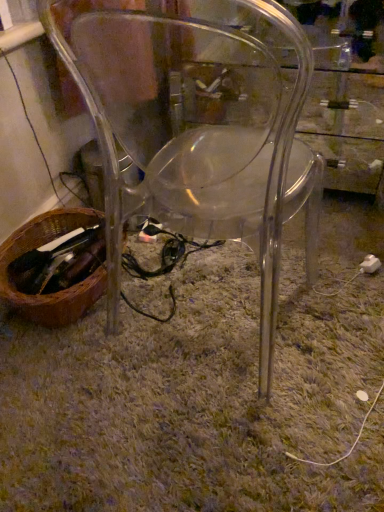
You are a GUI agent. You are given a task and a screenshot of the screen. Output one action in this format:
    pyautogui.click(x=<x>, y=<y>)
    Task: Click on the blank area to the left of white plastic plug at lower right
    
    Given the screenshot: What is the action you would take?
    pyautogui.click(x=318, y=276)